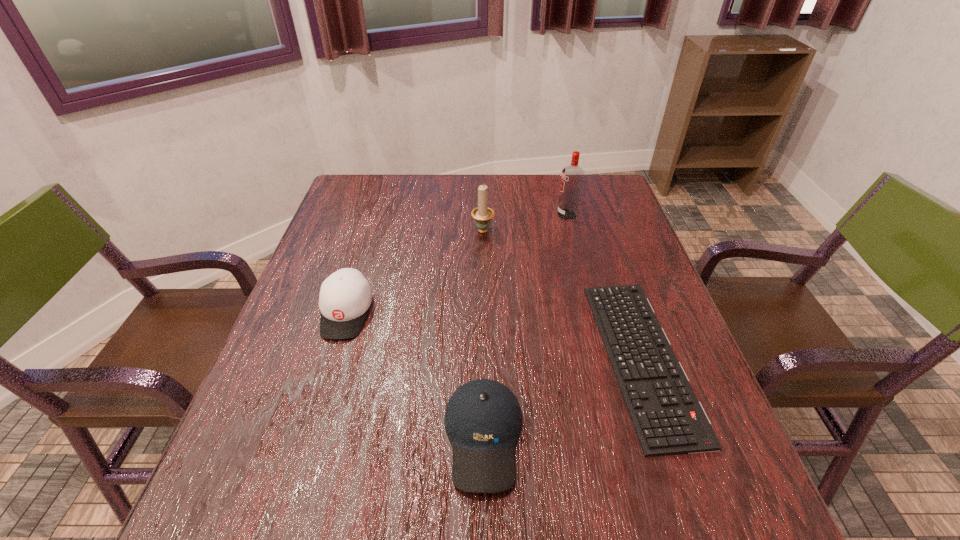
Where is `vacant space located 0.140m on the front label of the tallest object`? This screenshot has height=540, width=960. vacant space located 0.140m on the front label of the tallest object is located at coordinates (510, 214).

The width and height of the screenshot is (960, 540). Find the location of `free space located 0.050m on the front label of the tallest object`. free space located 0.050m on the front label of the tallest object is located at coordinates (540, 214).

The image size is (960, 540). I want to click on free spot located 0.130m on the handle side of the candle_holder, so click(x=483, y=198).

The height and width of the screenshot is (540, 960). What are the coordinates of `free point located on the handle side of the candle_holder` in the screenshot? It's located at (483, 210).

Locate an element on the screen. vacant space located on the handle side of the candle_holder is located at coordinates coord(483,206).

Where is `blank space located on the front-facing side of the farther baseball cap`? The image size is (960, 540). blank space located on the front-facing side of the farther baseball cap is located at coordinates (325, 381).

You are a GUI agent. You are given a task and a screenshot of the screen. Output one action in this format:
    pyautogui.click(x=<x>, y=<y>)
    Task: Click on the vacant space located 0.330m on the back of the shortest object
    The width and height of the screenshot is (960, 540).
    Given the screenshot: What is the action you would take?
    click(x=592, y=213)

The width and height of the screenshot is (960, 540). Identify the location of object that is positioned at the far edge. (572, 177).

This screenshot has height=540, width=960. What are the coordinates of `object located at the near edge` in the screenshot? It's located at (483, 420).

Where is `object present at the left edge`? The width and height of the screenshot is (960, 540). object present at the left edge is located at coordinates (345, 296).